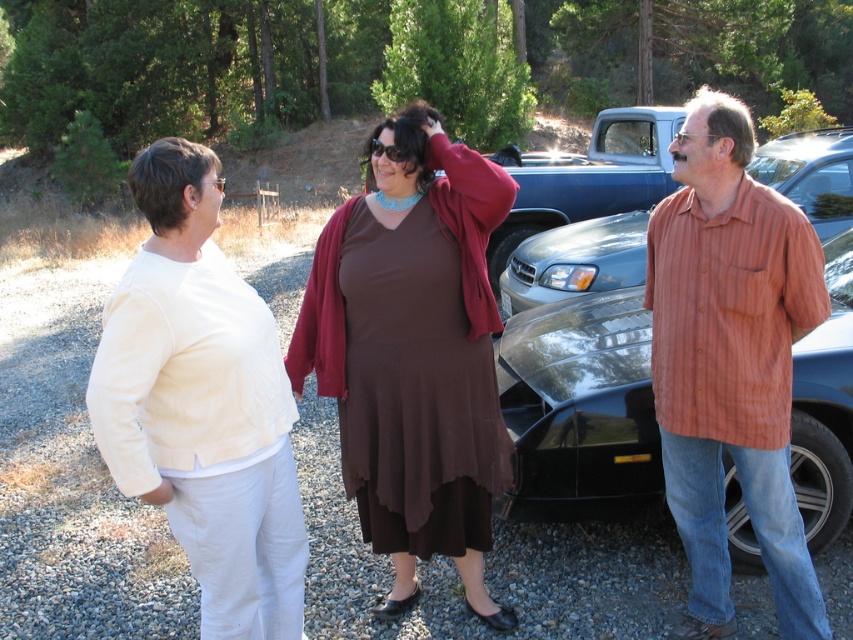
Is point (184, 388) behind point (550, 308)?

No, it is in front of (550, 308).

Which is below, matte white shirt at left or black glossy car at center?

Positioned lower is matte white shirt at left.

Image resolution: width=853 pixels, height=640 pixels. Find the location of `matte white shirt at left`. matte white shirt at left is located at coordinates (202, 403).

Can you confirm if brown matte dress at center is taller than black glossy car at center?

Indeed, brown matte dress at center has a greater height compared to black glossy car at center.

Is brown matte dress at center closer to the viewer compared to black glossy car at center?

Yes, brown matte dress at center is in front of black glossy car at center.

Which is in front, point (351, 316) or point (840, 486)?

Point (351, 316) is more forward.

At what (x,y) coordinates should I click in order to perform the action: click on brown matte dress at center. Please return your answer as a coordinate pair (x, y). The height and width of the screenshot is (640, 853). Looking at the image, I should click on (413, 353).

Can you confirm if matte white shirt at left is bigger than shiny metallic sedan at center?

Correct, matte white shirt at left is larger in size than shiny metallic sedan at center.

Is point (277, 468) farther from viewer compared to point (553, 282)?

No, it is not.

In order to click on matte white shirt at left in this screenshot , I will do `click(202, 403)`.